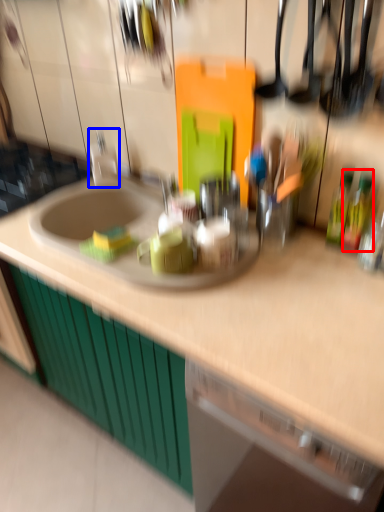
Question: Which point is further to the camera, bottle (highlighted by a red box) or faucet (highlighted by a blue box)?

Choices:
 (A) bottle
 (B) faucet

Answer: (B)